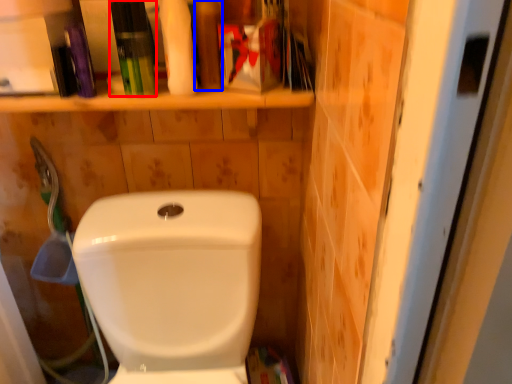
Question: Which object appears closest to the camera in this image, toiletry (highlighted by a red box) or toiletry (highlighted by a blue box)?

Choices:
 (A) toiletry
 (B) toiletry

Answer: (A)